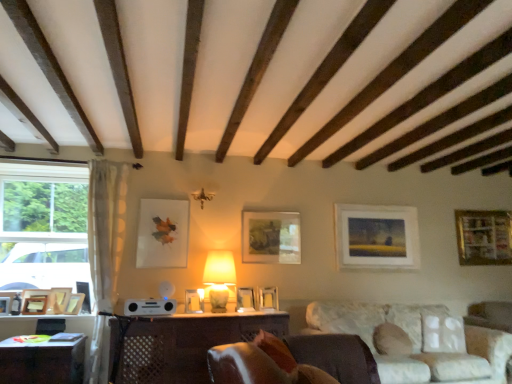
At what (x,y) coordinates should I click in order to perform the action: click on free space above matte white picture frame at center right, placed as the second picture frame when sorted from right to left (from a real-world perspective). Please return your answer as a coordinate pair (x, y). This screenshot has width=512, height=384. Looking at the image, I should click on (376, 205).